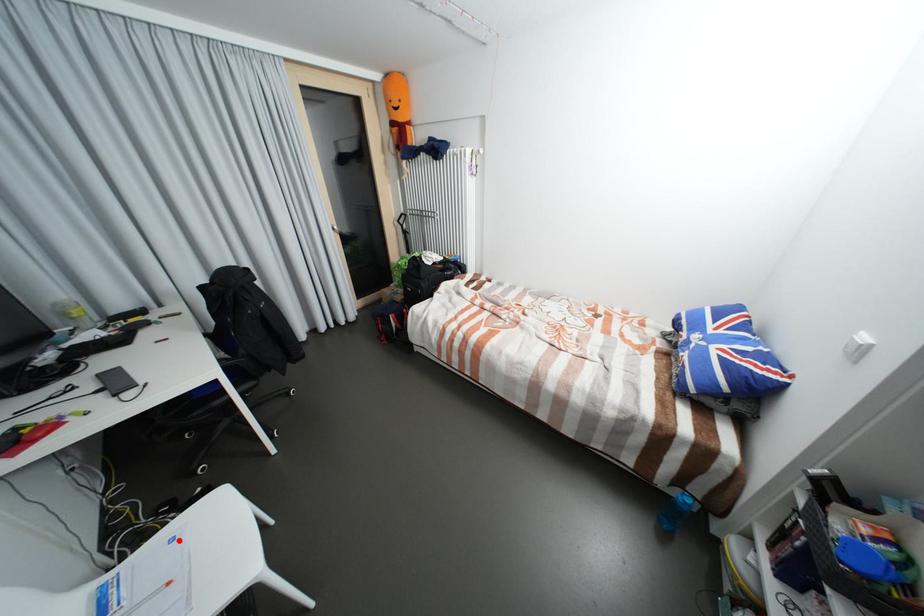
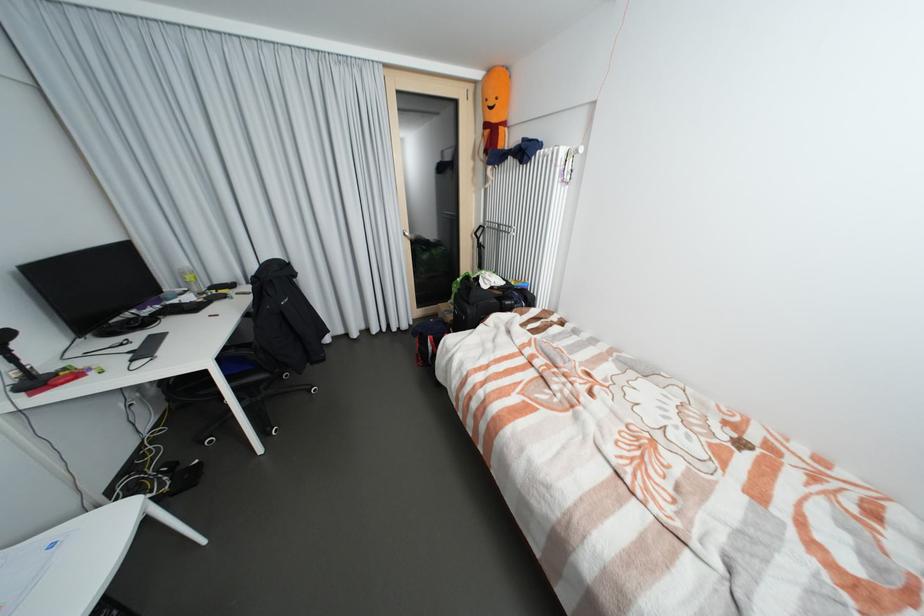
The point at the highlighted location is marked in the first image. Where is the corresponding point in the second image?

(59, 546)